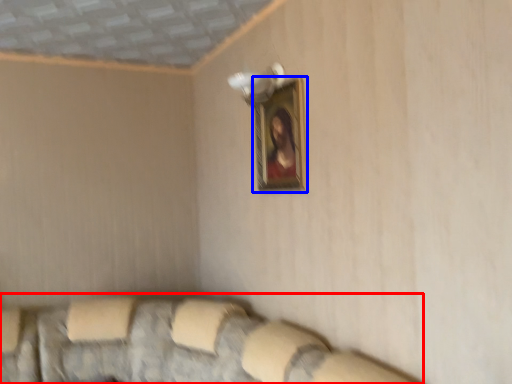
Question: Which of the following is the closest to the observer, couch (highlighted by a red box) or picture frame (highlighted by a blue box)?

Choices:
 (A) couch
 (B) picture frame

Answer: (A)